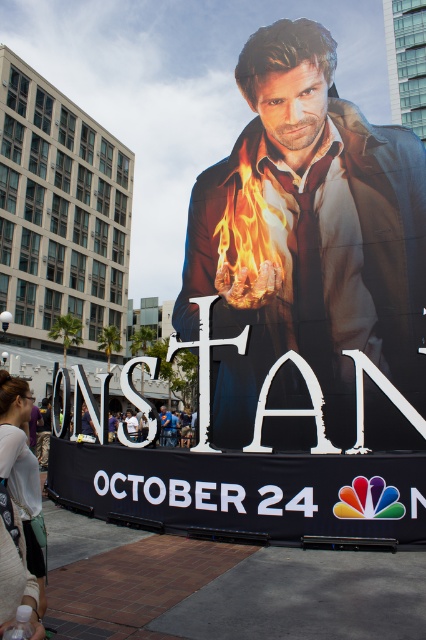
You are a costume designer looking at the promotional display for the show Constantine. You notice the smooth leather jacket at center. Can you determine its exact position on the image using coordinates?

The smooth leather jacket at center is located at coordinates point (310, 237).

You are a costume designer preparing for the movie Constantine. You have two items to place on a rack for display. The smooth leather jacket at center and the white textured shirt at lower left. Which item requires a wider hanger?

The white textured shirt at lower left requires a wider hanger because its width is greater than the smooth leather jacket at center.